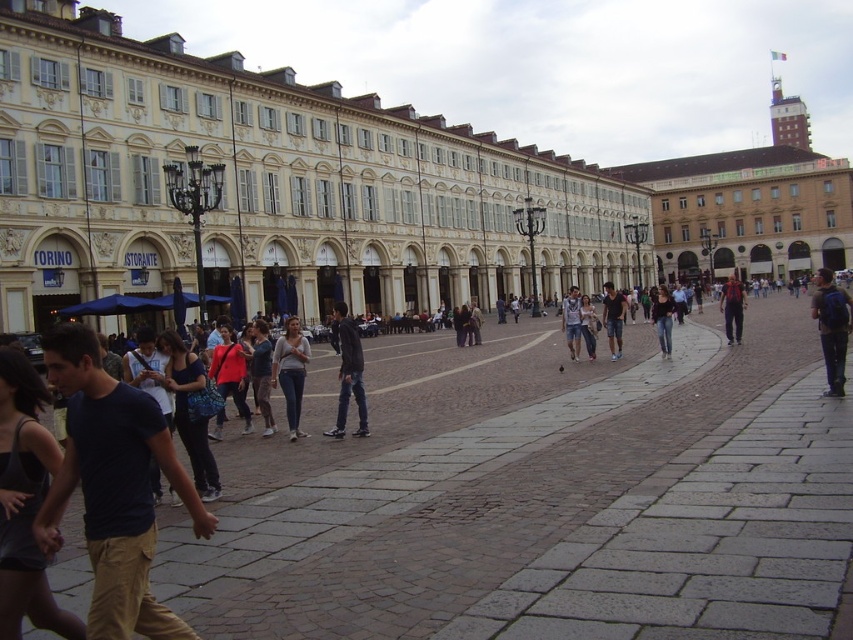
Question: Which is nearer to the dark red backpack at center?

Choices:
 (A) dark gray leather jacket at center
 (B) denim shorts at center

Answer: (B)

Question: Can you confirm if dark red backpack at center is smaller than denim shorts at center?

Choices:
 (A) yes
 (B) no

Answer: (B)

Question: Can you confirm if white stone building at center is bigger than dark red backpack at center?

Choices:
 (A) no
 (B) yes

Answer: (B)

Question: Which object is the closest to the dark red backpack at center?

Choices:
 (A) dark blue backpack at right
 (B) dark blue t-shirt at center

Answer: (A)

Question: Among these points, which one is farthest from the camera?

Choices:
 (A) (659, 340)
 (B) (602, 289)
 (C) (577, 314)

Answer: (B)

Question: Does white stone building at center come behind dark blue backpack at right?

Choices:
 (A) yes
 (B) no

Answer: (A)